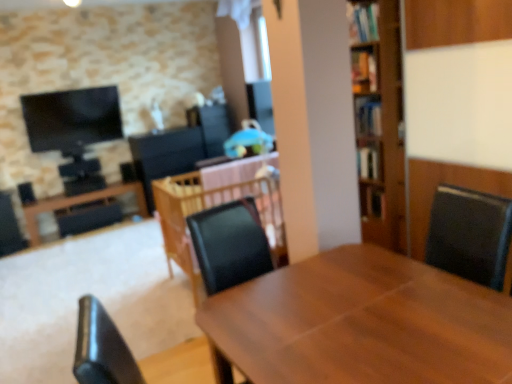
Question: Is wooden bookshelf at right, positioned as the second shelf in top-to-bottom order, at the right side of wooden table at center, placed as the 2th table when sorted from left to right?

Choices:
 (A) yes
 (B) no

Answer: (A)

Question: Considering the relative positions of wooden bookshelf at right, which is the 1th shelf in right-to-left order, and wooden table at center, the second table in the back-to-front sequence, in the image provided, is wooden bookshelf at right, which is the 1th shelf in right-to-left order, to the left of wooden table at center, the second table in the back-to-front sequence, from the viewer's perspective?

Choices:
 (A) yes
 (B) no

Answer: (B)

Question: Is wooden bookshelf at right, which ranks as the second shelf in left-to-right order, positioned with its back to wooden table at center, placed as the 2th table when sorted from left to right?

Choices:
 (A) yes
 (B) no

Answer: (B)

Question: Can you confirm if wooden bookshelf at right, placed as the second shelf when sorted from front to back, is smaller than wooden table at center, the second table in the back-to-front sequence?

Choices:
 (A) yes
 (B) no

Answer: (A)

Question: From a real-world perspective, is wooden bookshelf at right, the 1th shelf in the bottom-to-top sequence, beneath wooden table at center, the 2th table in the front-to-back sequence?

Choices:
 (A) yes
 (B) no

Answer: (B)

Question: From a real-world perspective, is wooden bookshelf at right, the 1th shelf in the bottom-to-top sequence, located higher than wooden table at center, placed as the 2th table when sorted from left to right?

Choices:
 (A) yes
 (B) no

Answer: (A)

Question: Does wooden table at center, which is counted as the 2th table, starting from the right, have a larger size compared to wooden table at center, which is counted as the first table, starting from the right?

Choices:
 (A) yes
 (B) no

Answer: (B)

Question: Is wooden table at center, the 2th table in the front-to-back sequence, at the right side of wooden table at center, the first table viewed from the front?

Choices:
 (A) yes
 (B) no

Answer: (B)

Question: Can you confirm if wooden table at center, the second table in the back-to-front sequence, is taller than wooden table at center, the first table viewed from the front?

Choices:
 (A) yes
 (B) no

Answer: (A)

Question: From the image's perspective, is wooden table at center, placed as the 2th table when sorted from left to right, on top of wooden table at center, the third table when ordered from left to right?

Choices:
 (A) no
 (B) yes

Answer: (B)

Question: From a real-world perspective, is wooden table at center, the second table in the back-to-front sequence, under wooden table at center, the first table viewed from the front?

Choices:
 (A) yes
 (B) no

Answer: (B)

Question: Is wooden table at center, which is counted as the 2th table, starting from the right, thinner than wooden table at center, the first table viewed from the front?

Choices:
 (A) yes
 (B) no

Answer: (B)

Question: Is wooden bookshelf at right, which is the first shelf from back to front, shorter than wooden table at center, marked as the 3th table in a back-to-front arrangement?

Choices:
 (A) no
 (B) yes

Answer: (B)